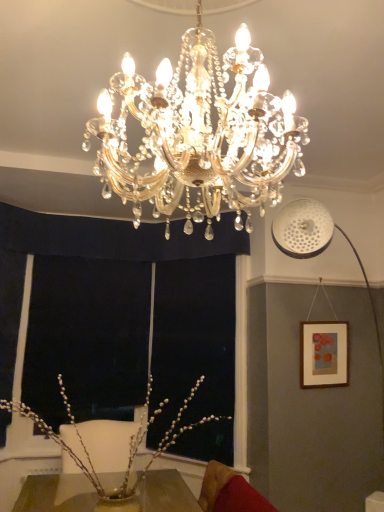
Question: From their relative heights in the image, would you say pearl-like branches at center is taller or shorter than gold crystal chandelier at center?

Choices:
 (A) tall
 (B) short

Answer: (B)

Question: Considering the positions of pearl-like branches at center and gold crystal chandelier at center in the image, is pearl-like branches at center wider or thinner than gold crystal chandelier at center?

Choices:
 (A) wide
 (B) thin

Answer: (B)

Question: Which of these objects is positioned farthest from the pearl-like branches at center?

Choices:
 (A) velvet red swivel chair at lower right
 (B) gold crystal chandelier at center
 (C) wooden picture frame at right

Answer: (B)

Question: Estimate the real-world distances between objects in this image. Which object is farther from the pearl-like branches at center?

Choices:
 (A) gold crystal chandelier at center
 (B) wooden picture frame at right
 (C) velvet red swivel chair at lower right

Answer: (A)